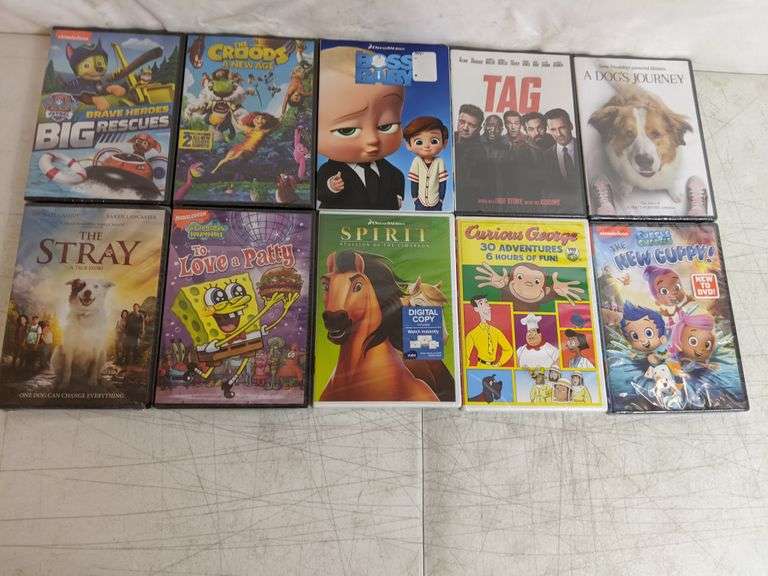
Identify the location of dvd case. This screenshot has width=768, height=576. (98, 87), (240, 109), (381, 124), (507, 131), (651, 138), (654, 295), (555, 286), (406, 301), (236, 291), (77, 288).